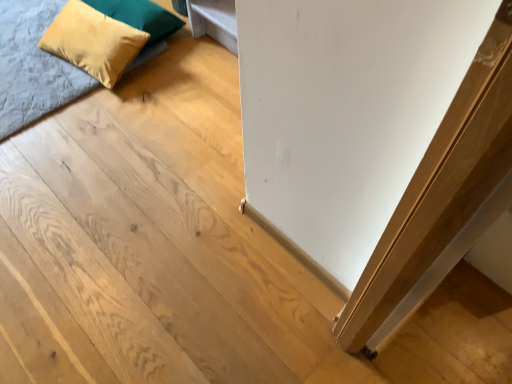
Question: Is velvet yellow pillow at upper left, which is counted as the first pillow, starting from the bottom, in contact with suede yellow pillow at upper left, which appears as the second pillow when ordered from the bottom?

Choices:
 (A) yes
 (B) no

Answer: (B)

Question: Is suede yellow pillow at upper left, which appears as the second pillow when ordered from the bottom, completely or partially inside velvet yellow pillow at upper left, which is counted as the first pillow, starting from the bottom?

Choices:
 (A) yes
 (B) no

Answer: (B)

Question: Is velvet yellow pillow at upper left, the 2th pillow from the top, further to camera compared to suede yellow pillow at upper left, the 1th pillow viewed from the top?

Choices:
 (A) no
 (B) yes

Answer: (A)

Question: Is velvet yellow pillow at upper left, which is counted as the first pillow, starting from the bottom, facing away from suede yellow pillow at upper left, the 1th pillow viewed from the top?

Choices:
 (A) no
 (B) yes

Answer: (B)

Question: Is velvet yellow pillow at upper left, which is counted as the first pillow, starting from the bottom, to the right of suede yellow pillow at upper left, which appears as the second pillow when ordered from the bottom, from the viewer's perspective?

Choices:
 (A) no
 (B) yes

Answer: (A)

Question: Does velvet yellow pillow at upper left, the 2th pillow from the top, turn towards suede yellow pillow at upper left, which appears as the second pillow when ordered from the bottom?

Choices:
 (A) no
 (B) yes

Answer: (A)

Question: Is suede yellow pillow at upper left, which appears as the second pillow when ordered from the bottom, smaller than velvet blue bed at upper left?

Choices:
 (A) yes
 (B) no

Answer: (A)

Question: Is suede yellow pillow at upper left, which appears as the second pillow when ordered from the bottom, far away from velvet blue bed at upper left?

Choices:
 (A) no
 (B) yes

Answer: (A)

Question: Is suede yellow pillow at upper left, the 1th pillow viewed from the top, looking in the opposite direction of velvet blue bed at upper left?

Choices:
 (A) no
 (B) yes

Answer: (A)

Question: Considering the relative sizes of suede yellow pillow at upper left, which appears as the second pillow when ordered from the bottom, and velvet blue bed at upper left in the image provided, is suede yellow pillow at upper left, which appears as the second pillow when ordered from the bottom, taller than velvet blue bed at upper left?

Choices:
 (A) yes
 (B) no

Answer: (A)

Question: Could you tell me if suede yellow pillow at upper left, which appears as the second pillow when ordered from the bottom, is turned towards velvet blue bed at upper left?

Choices:
 (A) no
 (B) yes

Answer: (B)

Question: Is suede yellow pillow at upper left, which appears as the second pillow when ordered from the bottom, wider than velvet blue bed at upper left?

Choices:
 (A) yes
 (B) no

Answer: (B)

Question: Does velvet blue bed at upper left have a greater width compared to suede yellow pillow at upper left, the 1th pillow viewed from the top?

Choices:
 (A) no
 (B) yes

Answer: (B)